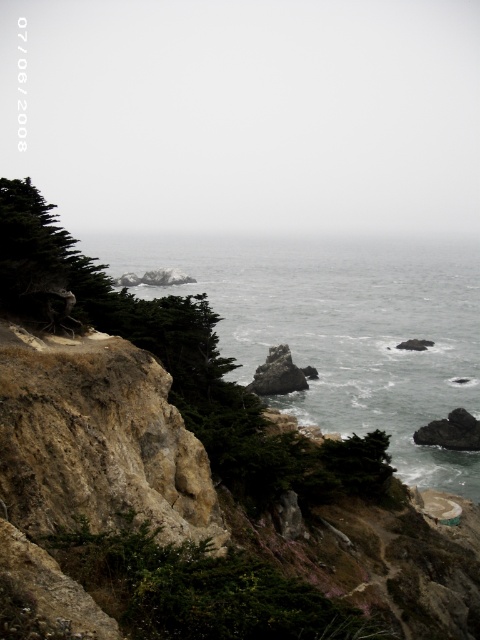
Can you confirm if dark gray rock at center right is bigger than rusty rock at center?

Yes.

Between point (435, 433) and point (264, 392), which one is positioned behind?

Point (264, 392)

Who is more forward, (453, 416) or (272, 346)?

Point (453, 416)

The height and width of the screenshot is (640, 480). I want to click on dark gray rock at center right, so click(451, 432).

Can you confirm if gray/rocky water at center is thinner than rusty rock at center?

Incorrect, gray/rocky water at center's width is not less than rusty rock at center's.

Who is more forward, (348, 304) or (264, 392)?

Point (264, 392)

The height and width of the screenshot is (640, 480). Describe the element at coordinates (339, 326) in the screenshot. I see `gray/rocky water at center` at that location.

This screenshot has width=480, height=640. I want to click on gray/rocky water at center, so click(339, 326).

Between gray/rocky water at center and dark gray rock at center right, which one appears on the right side from the viewer's perspective?

dark gray rock at center right

Looking at this image, which is below, gray/rocky water at center or dark gray rock at center right?

Positioned lower is dark gray rock at center right.

You are a GUI agent. You are given a task and a screenshot of the screen. Output one action in this format:
    pyautogui.click(x=<x>, y=<y>)
    Task: Click on the gray/rocky water at center
    
    Given the screenshot: What is the action you would take?
    pyautogui.click(x=339, y=326)